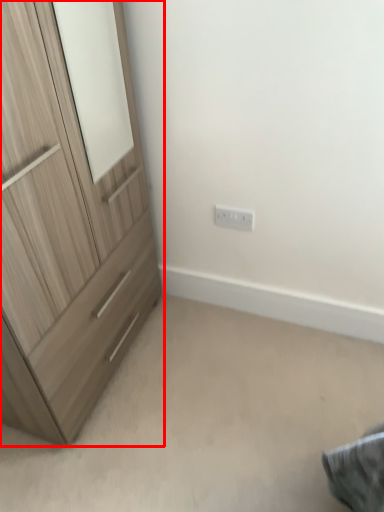
Question: From the image's perspective, what is the correct spatial positioning of chest of drawers (annotated by the red box) in reference to electric outlet?

Choices:
 (A) above
 (B) below

Answer: (B)